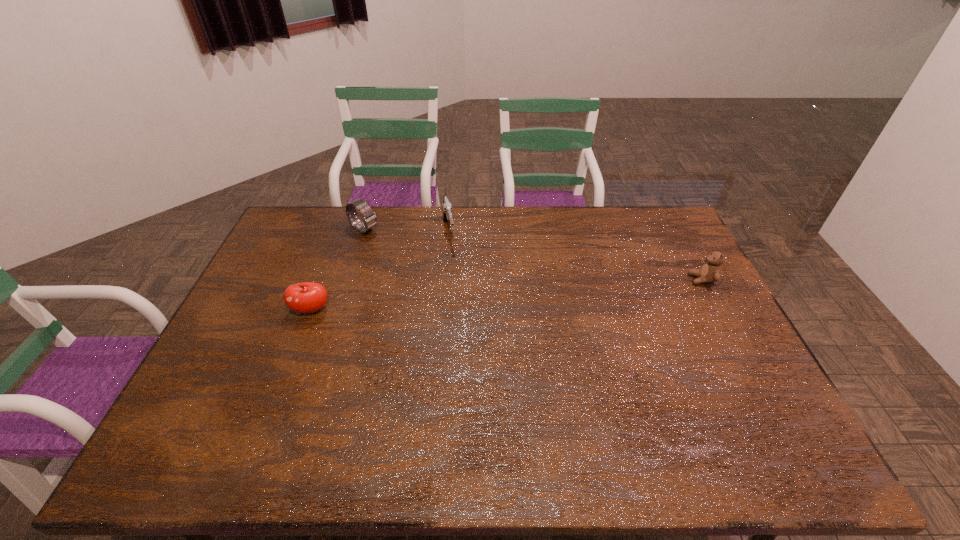
At what (x,y) coordinates should I click in order to perform the action: click on apple. Please return your answer as a coordinate pair (x, y). Looking at the image, I should click on (307, 297).

This screenshot has height=540, width=960. I want to click on teddy bear, so click(710, 272).

The width and height of the screenshot is (960, 540). I want to click on the rightmost object, so click(x=710, y=272).

The height and width of the screenshot is (540, 960). I want to click on gun, so click(x=446, y=205).

This screenshot has width=960, height=540. Identify the location of watch. (370, 219).

At what (x,y) coordinates should I click in order to perform the action: click on free location located on the stem of the nearest object. Please return your answer as a coordinate pair (x, y). This screenshot has width=960, height=540. Looking at the image, I should click on (285, 379).

Locate an element on the screen. The width and height of the screenshot is (960, 540). blank space located 0.340m on the front-facing side of the rightmost object is located at coordinates (585, 279).

Image resolution: width=960 pixels, height=540 pixels. I want to click on blank space located on the front-facing side of the rightmost object, so click(612, 279).

I want to click on blank space located 0.260m on the front-facing side of the rightmost object, so click(x=610, y=279).

Where is `free space located at the muzzle of the gun`? This screenshot has height=540, width=960. free space located at the muzzle of the gun is located at coordinates (468, 318).